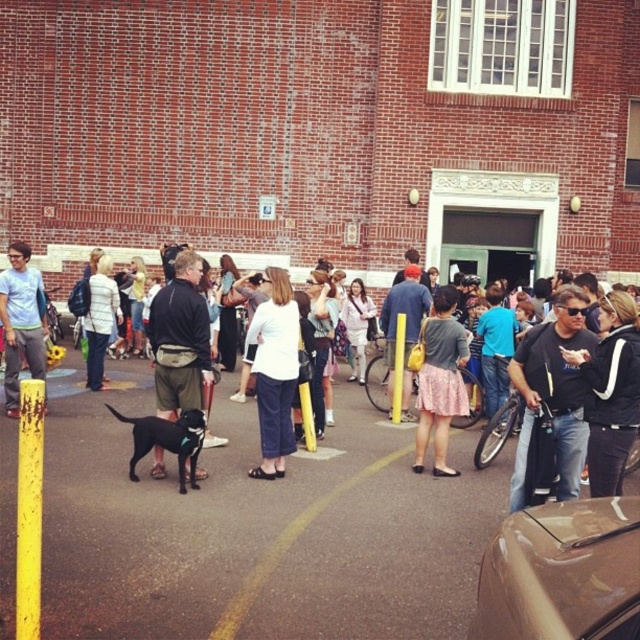
Question: Which point is farther to the camera?

Choices:
 (A) (129, 467)
 (B) (257, 577)
 (C) (28, 362)
 (D) (456, 380)

Answer: (C)

Question: Which point is closer to the camera taking this photo?

Choices:
 (A) (100, 337)
 (B) (573, 388)
 (C) (234, 627)
 (D) (637, 621)

Answer: (D)

Question: Is white matte pants at center further to camera compared to white matte jacket at center?

Choices:
 (A) yes
 (B) no

Answer: (B)

Question: Among these points, which one is farthest from the camera?

Choices:
 (A) (516, 499)
 (B) (262, 403)

Answer: (B)

Question: Can you confirm if dark brown leather jacket at center is positioned to the right of matte gray sweater at center?

Choices:
 (A) yes
 (B) no

Answer: (B)

Question: Can you confirm if shiny gold car at lower right is smaller than white matte jacket at center?

Choices:
 (A) no
 (B) yes

Answer: (B)